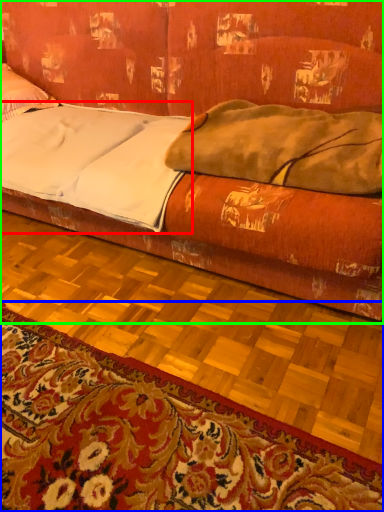
Question: Estimate the real-world distances between objects in this image. Which object is closer to sheet (highlighted by a red box), mat (highlighted by a blue box) or studio couch (highlighted by a green box)?

Choices:
 (A) mat
 (B) studio couch

Answer: (B)